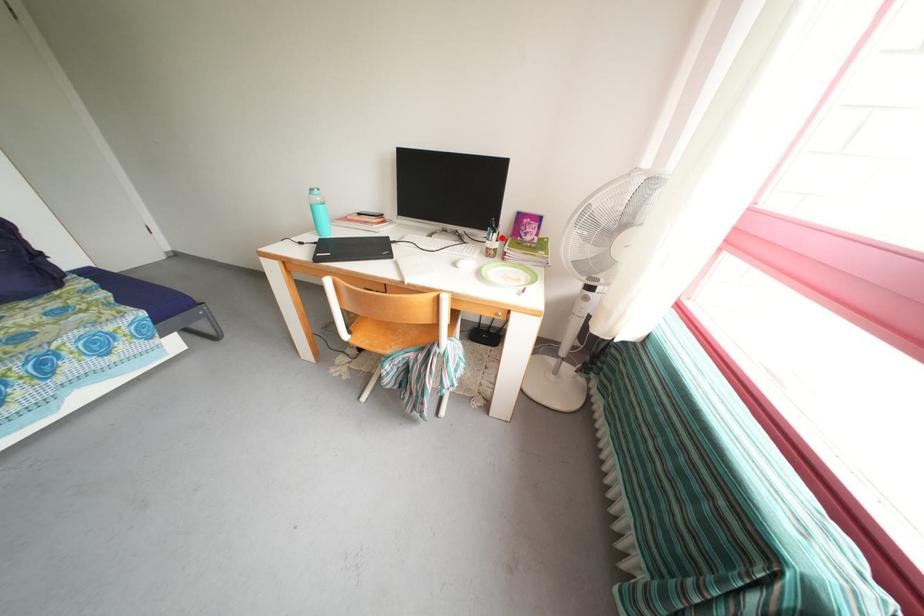
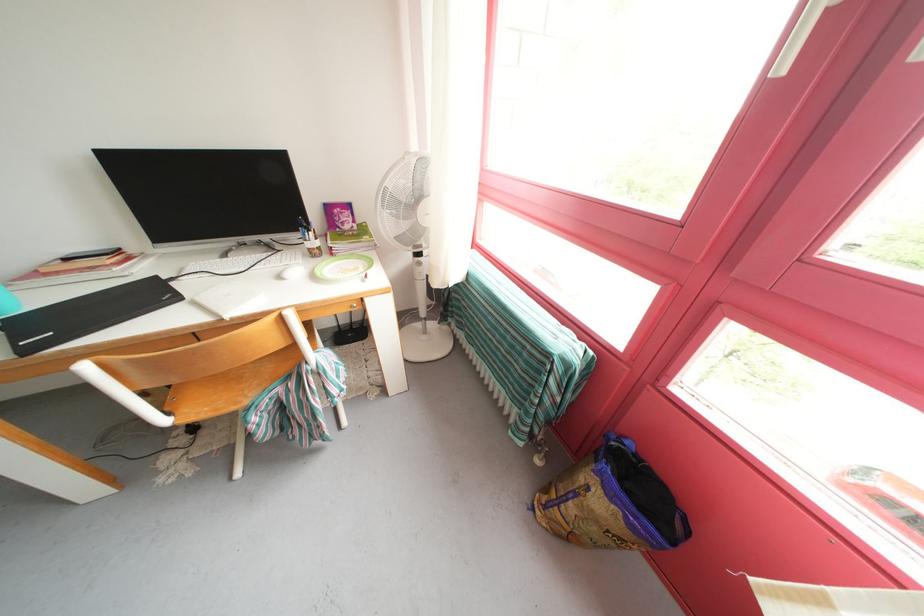
Where in the second image is the point corresponding to the highlighted location from the first image?

(315, 236)